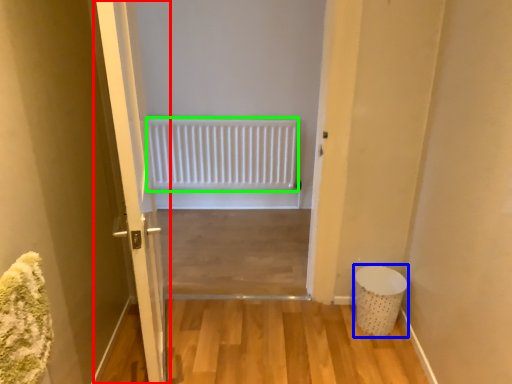
Question: Considering the real-world distances, which object is closest to door (highlighted by a red box)? laundry basket (highlighted by a blue box) or radiator (highlighted by a green box).

Choices:
 (A) laundry basket
 (B) radiator

Answer: (A)